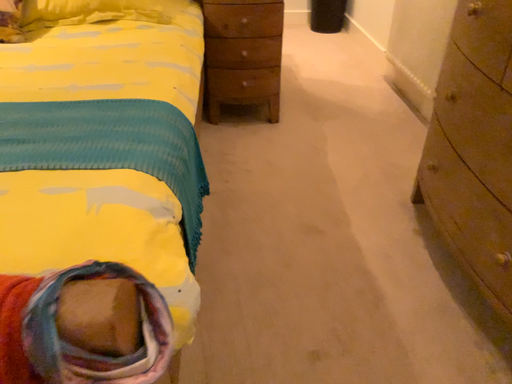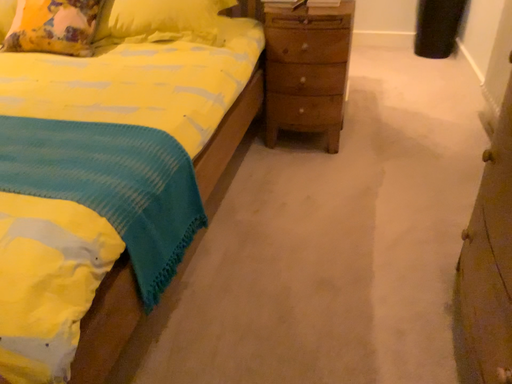
Question: Which way did the camera rotate in the video?

Choices:
 (A) rotated left
 (B) rotated right

Answer: (A)